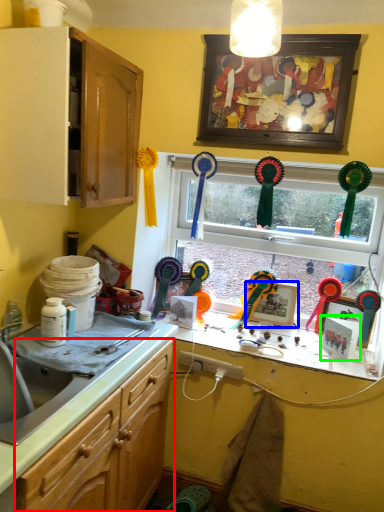
Question: Estimate the real-world distances between objects in this image. Which object is farther from cabinetry (highlighted by a red box), picture frame (highlighted by a blue box) or picture frame (highlighted by a green box)?

Choices:
 (A) picture frame
 (B) picture frame

Answer: (B)